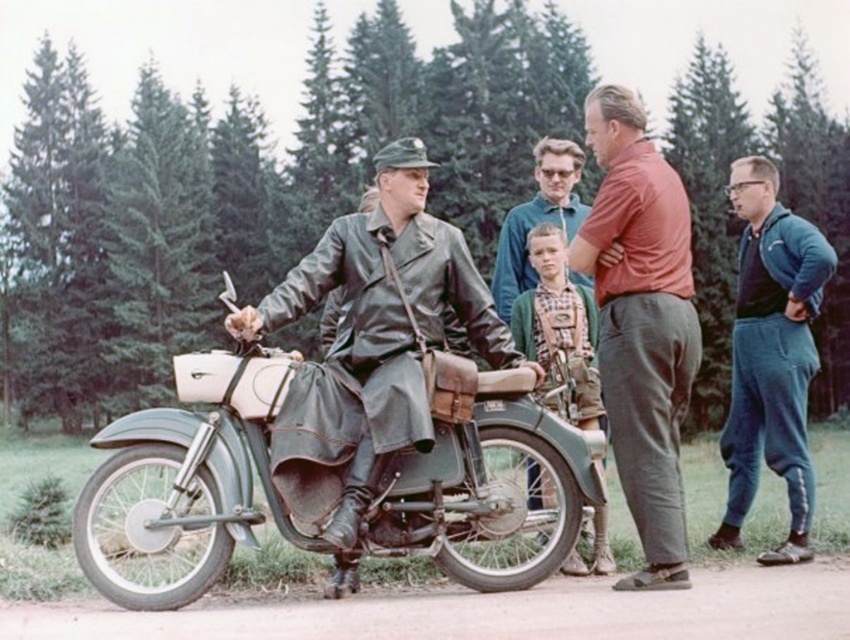
Question: Does matte red shirt at center appear on the left side of green leather jacket at center?

Choices:
 (A) no
 (B) yes

Answer: (A)

Question: Which point is closer to the camera taking this photo?

Choices:
 (A) (550, 150)
 (B) (513, 337)
 (C) (366, 224)
 (D) (777, 300)

Answer: (C)

Question: Is green matte motorcycle at center in front of matte red shirt at center?

Choices:
 (A) no
 (B) yes

Answer: (B)

Question: Which object is positioned farthest from the green wool sweater at center?

Choices:
 (A) matte red shirt at center
 (B) dark blue sweatpants at right

Answer: (B)

Question: Can you confirm if green matte motorcycle at center is wider than green leather jacket at center?

Choices:
 (A) no
 (B) yes

Answer: (B)

Question: Which object is farther from the camera taking this photo?

Choices:
 (A) matte red shirt at center
 (B) green matte motorcycle at center
 (C) green knitted sweater at center
 (D) green leather jacket at center

Answer: (C)